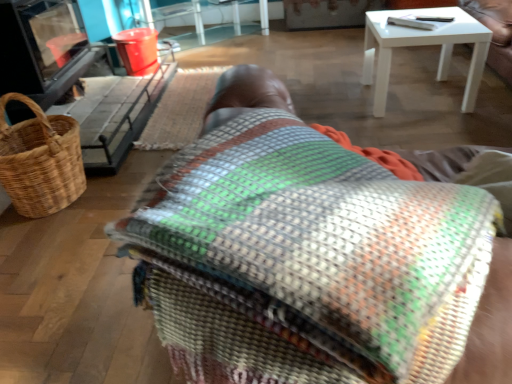
Question: Considering the relative positions of translucent plastic table at upper center and brown woven picnic basket at left in the image provided, is translucent plastic table at upper center to the left of brown woven picnic basket at left from the viewer's perspective?

Choices:
 (A) no
 (B) yes

Answer: (A)

Question: From a real-world perspective, is translucent plastic table at upper center positioned under brown woven picnic basket at left based on gravity?

Choices:
 (A) yes
 (B) no

Answer: (A)

Question: Is translucent plastic table at upper center wider than brown woven picnic basket at left?

Choices:
 (A) yes
 (B) no

Answer: (A)

Question: Is translucent plastic table at upper center next to brown woven picnic basket at left?

Choices:
 (A) no
 (B) yes

Answer: (A)

Question: From the image's perspective, is translucent plastic table at upper center over brown woven picnic basket at left?

Choices:
 (A) yes
 (B) no

Answer: (A)

Question: Does translucent plastic table at upper center have a greater height compared to brown woven picnic basket at left?

Choices:
 (A) yes
 (B) no

Answer: (B)

Question: Does brown woven picnic basket at left have a smaller size compared to translucent plastic table at upper center?

Choices:
 (A) no
 (B) yes

Answer: (B)

Question: Is brown woven picnic basket at left to the right of translucent plastic table at upper center from the viewer's perspective?

Choices:
 (A) yes
 (B) no

Answer: (B)

Question: Is brown woven picnic basket at left aimed at translucent plastic table at upper center?

Choices:
 (A) yes
 (B) no

Answer: (B)

Question: Is translucent plastic table at upper center a part of brown woven picnic basket at left?

Choices:
 (A) no
 (B) yes

Answer: (A)

Question: Would you say brown woven picnic basket at left is a long distance from translucent plastic table at upper center?

Choices:
 (A) yes
 (B) no

Answer: (A)

Question: Is brown woven picnic basket at left outside of translucent plastic table at upper center?

Choices:
 (A) no
 (B) yes

Answer: (B)

Question: Is brown woven picnic basket at left completely or partially outside of multicolored woven blanket at center?

Choices:
 (A) no
 (B) yes

Answer: (B)